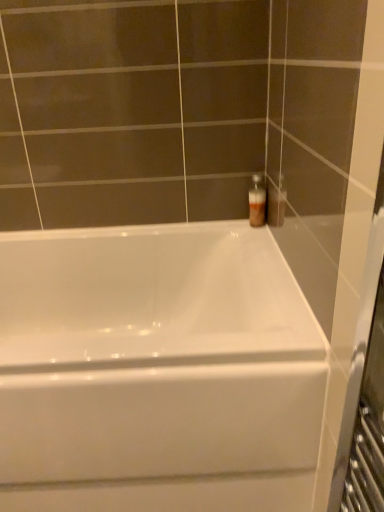
Question: From a real-world perspective, is translucent plastic bottle at upper right positioned over white glossy bathtub at center based on gravity?

Choices:
 (A) yes
 (B) no

Answer: (A)

Question: Can you confirm if translucent plastic bottle at upper right is smaller than white glossy bathtub at center?

Choices:
 (A) no
 (B) yes

Answer: (B)

Question: Considering the relative sizes of translucent plastic bottle at upper right and white glossy bathtub at center in the image provided, is translucent plastic bottle at upper right bigger than white glossy bathtub at center?

Choices:
 (A) yes
 (B) no

Answer: (B)

Question: Is translucent plastic bottle at upper right oriented towards white glossy bathtub at center?

Choices:
 (A) yes
 (B) no

Answer: (B)

Question: Is translucent plastic bottle at upper right placed right next to white glossy bathtub at center?

Choices:
 (A) yes
 (B) no

Answer: (B)

Question: Can you confirm if translucent plastic bottle at upper right is wider than white glossy bathtub at center?

Choices:
 (A) yes
 (B) no

Answer: (B)

Question: Is translucent plastic bottle at upper right a part of white glossy bathtub at center?

Choices:
 (A) no
 (B) yes

Answer: (A)

Question: From the image's perspective, is white glossy bathtub at center beneath translucent plastic bottle at upper right?

Choices:
 (A) no
 (B) yes

Answer: (B)

Question: Is white glossy bathtub at center aimed at translucent plastic bottle at upper right?

Choices:
 (A) yes
 (B) no

Answer: (B)

Question: Does white glossy bathtub at center touch translucent plastic bottle at upper right?

Choices:
 (A) yes
 (B) no

Answer: (B)

Question: Is white glossy bathtub at center positioned behind translucent plastic bottle at upper right?

Choices:
 (A) no
 (B) yes

Answer: (A)

Question: From a real-world perspective, is white glossy bathtub at center located higher than translucent plastic bottle at upper right?

Choices:
 (A) no
 (B) yes

Answer: (A)

Question: In terms of size, does translucent plastic bottle at upper right appear bigger or smaller than white glossy bathtub at center?

Choices:
 (A) big
 (B) small

Answer: (B)